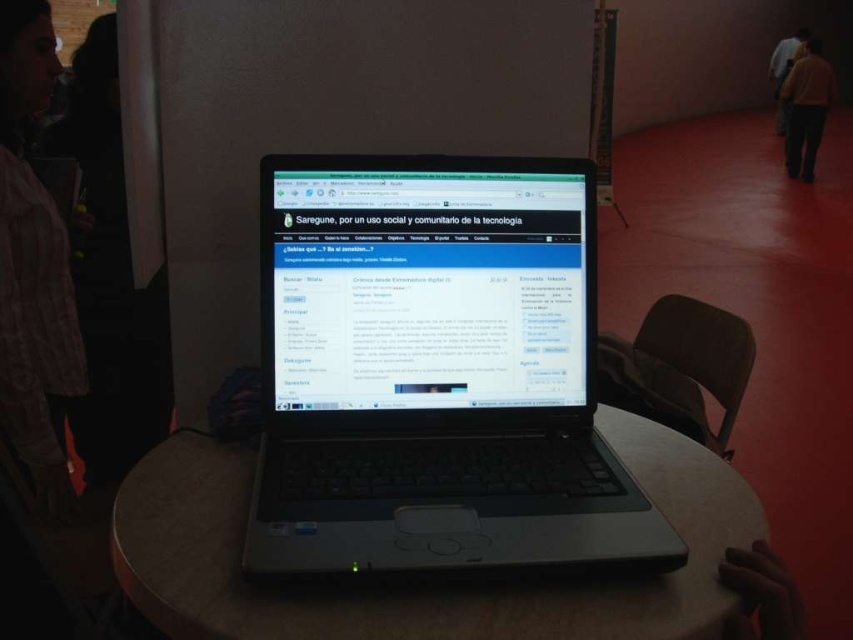
Consider the image. You are a technician trying to identify two laptops on a table. You notice there are two laptops at the center of the table. How far apart are the black plastic laptop at center and the shiny black laptop at center?

The black plastic laptop at center and the shiny black laptop at center are 1.27 inches apart from each other.

In the scene shown: You are a photographer taking a picture of the laptop on the table. You notice the pink textured shirt at left and the dark brown pants at upper right in the background. Which object should you adjust your camera angle to focus on if you want to capture the smaller one?

The pink textured shirt at left is smaller than the dark brown pants at upper right, so you should adjust your camera angle to focus on the pink textured shirt at left.

You are organizing a tech event and need to place both the black plastic laptop at center and the shiny black laptop at center on a narrow table. According to the image, which laptop might require more horizontal space?

The black plastic laptop at center might require more horizontal space since it is wider than the shiny black laptop at center.